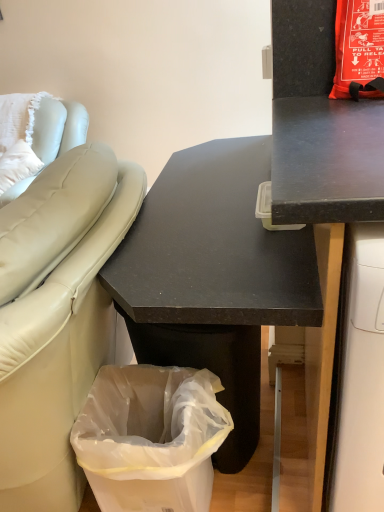
Question: Can you confirm if black matte desk at center, positioned as the second desk in right-to-left order, is bigger than transparent plastic bag at lower left?

Choices:
 (A) no
 (B) yes

Answer: (B)

Question: From the image's perspective, is black matte desk at center, which appears as the first desk when viewed from the left, on top of transparent plastic bag at lower left?

Choices:
 (A) yes
 (B) no

Answer: (A)

Question: Is black matte desk at center, positioned as the second desk in right-to-left order, directly adjacent to transparent plastic bag at lower left?

Choices:
 (A) yes
 (B) no

Answer: (B)

Question: Are black matte desk at center, positioned as the second desk in right-to-left order, and transparent plastic bag at lower left far apart?

Choices:
 (A) yes
 (B) no

Answer: (B)

Question: Considering the relative sizes of black matte desk at center, which appears as the first desk when viewed from the left, and transparent plastic bag at lower left in the image provided, is black matte desk at center, which appears as the first desk when viewed from the left, taller than transparent plastic bag at lower left?

Choices:
 (A) no
 (B) yes

Answer: (B)

Question: Is black matte desk at center, which appears as the first desk when viewed from the left, closer to the viewer compared to transparent plastic bag at lower left?

Choices:
 (A) yes
 (B) no

Answer: (A)

Question: Does black matte desk at center, positioned as the second desk in right-to-left order, have a larger size compared to white leather couch at left?

Choices:
 (A) yes
 (B) no

Answer: (A)

Question: From the image's perspective, is black matte desk at center, which appears as the first desk when viewed from the left, on top of white leather couch at left?

Choices:
 (A) yes
 (B) no

Answer: (B)

Question: Is black matte desk at center, positioned as the second desk in right-to-left order, outside white leather couch at left?

Choices:
 (A) yes
 (B) no

Answer: (A)

Question: From a real-world perspective, is black matte desk at center, positioned as the second desk in right-to-left order, beneath white leather couch at left?

Choices:
 (A) yes
 (B) no

Answer: (A)

Question: Is black matte desk at center, positioned as the second desk in right-to-left order, at the left side of white leather couch at left?

Choices:
 (A) no
 (B) yes

Answer: (A)

Question: From a real-world perspective, is black matte desk at center, which appears as the first desk when viewed from the left, on white leather couch at left?

Choices:
 (A) no
 (B) yes

Answer: (A)

Question: Is transparent plastic bag at lower left wider than black matte desk at upper right, the first desk positioned from the right?

Choices:
 (A) yes
 (B) no

Answer: (B)